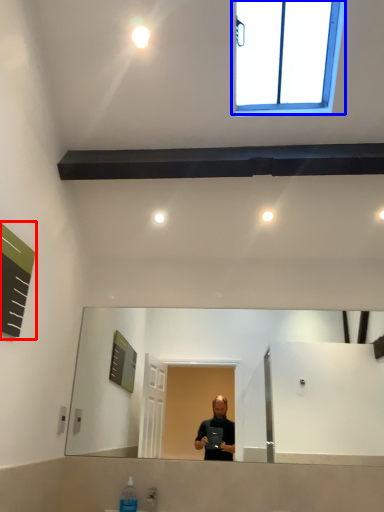
Question: Which point is closer to the camera, bulletin board (highlighted by a red box) or window (highlighted by a blue box)?

Choices:
 (A) bulletin board
 (B) window

Answer: (A)